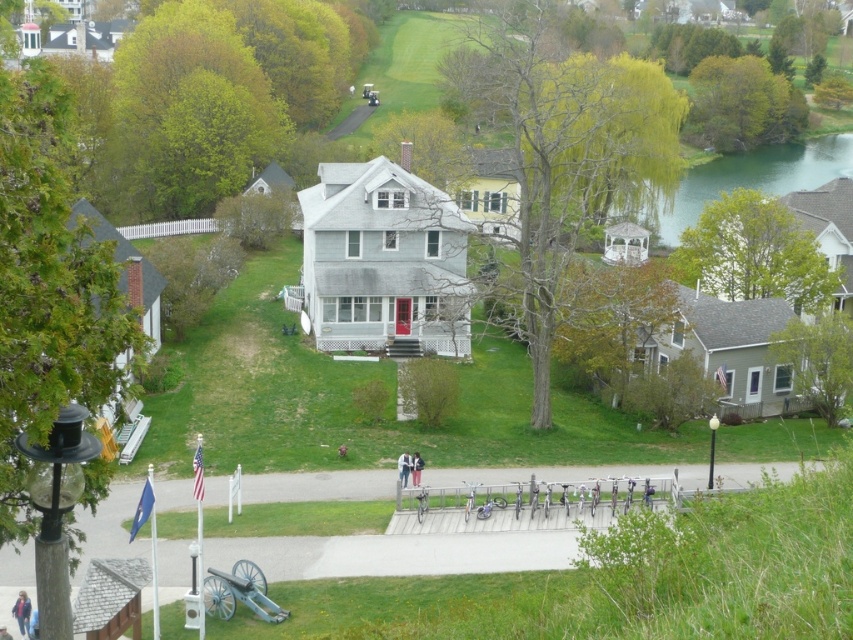
You are a drone operator trying to capture a photo of the suburban house. You want to ensure the green water at upper right is positioned exactly at the center of the image. Given its current coordinates at point 0.277, 0.885, what adjustment should you make to the drone camera to center it?

To center the green water at upper right, you need to move the drone camera so that the current coordinates of the object at (753, 177) align with the center point of the image, which is typically at (426, 320). Since the current x coordinate is 0.277, you should move the camera to the right by approximately 0.223 units. For the y coordinate, since 0.885 is above the center, move the camera downward by approximately 0.385 units to bring the green water at upper right to the center.